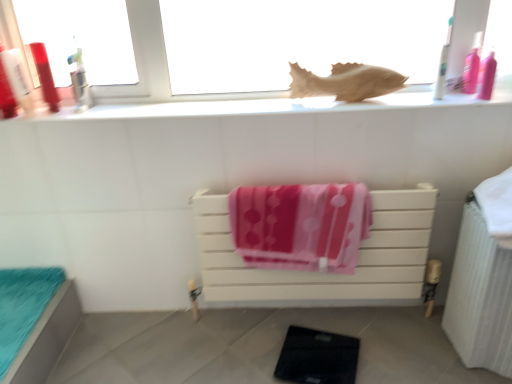
Question: Considering the relative sizes of white textured radiator at right and matte plastic toothbrush at upper left, arranged as the third toiletry when viewed from the right, in the image provided, is white textured radiator at right bigger than matte plastic toothbrush at upper left, arranged as the third toiletry when viewed from the right,?

Choices:
 (A) yes
 (B) no

Answer: (A)

Question: From a real-world perspective, does white textured radiator at right stand above matte plastic toothbrush at upper left, which ranks as the 2th toiletry in left-to-right order?

Choices:
 (A) yes
 (B) no

Answer: (B)

Question: Is white textured radiator at right far from matte plastic toothbrush at upper left, which ranks as the 2th toiletry in left-to-right order?

Choices:
 (A) no
 (B) yes

Answer: (B)

Question: Considering the relative sizes of white textured radiator at right and matte plastic toothbrush at upper left, which ranks as the 2th toiletry in left-to-right order, in the image provided, is white textured radiator at right wider than matte plastic toothbrush at upper left, which ranks as the 2th toiletry in left-to-right order,?

Choices:
 (A) no
 (B) yes

Answer: (B)

Question: Is white textured radiator at right positioned beyond the bounds of matte plastic toothbrush at upper left, arranged as the third toiletry when viewed from the right?

Choices:
 (A) yes
 (B) no

Answer: (A)

Question: Does point (22, 86) appear closer or farther from the camera than point (476, 41)?

Choices:
 (A) closer
 (B) farther

Answer: (A)

Question: From a real-world perspective, is matte plastic bottle at left, which is the 4th toiletry in right-to-left order, positioned above or below pink plastic bottle at upper right, the first toiletry from the right?

Choices:
 (A) above
 (B) below

Answer: (A)

Question: In the image, is matte plastic bottle at left, the 1th toiletry viewed from the left, positioned in front of or behind pink plastic bottle at upper right, positioned as the fourth toiletry in left-to-right order?

Choices:
 (A) behind
 (B) front

Answer: (B)

Question: Choose the correct answer: Is matte plastic bottle at left, which is the 4th toiletry in right-to-left order, inside pink plastic bottle at upper right, positioned as the fourth toiletry in left-to-right order, or outside it?

Choices:
 (A) outside
 (B) inside

Answer: (A)

Question: Would you say pink fabric beach towel at center is to the left or to the right of matte plastic bottle at left, the 1th toiletry viewed from the left, in the picture?

Choices:
 (A) right
 (B) left

Answer: (A)

Question: Is pink fabric beach towel at center inside the boundaries of matte plastic bottle at left, the 1th toiletry viewed from the left, or outside?

Choices:
 (A) inside
 (B) outside

Answer: (B)

Question: From the image's perspective, relative to matte plastic bottle at left, the 1th toiletry viewed from the left, is pink fabric beach towel at center above or below?

Choices:
 (A) above
 (B) below

Answer: (B)

Question: Considering the positions of pink fabric beach towel at center and matte plastic bottle at left, which is the 4th toiletry in right-to-left order, in the image, is pink fabric beach towel at center taller or shorter than matte plastic bottle at left, which is the 4th toiletry in right-to-left order,?

Choices:
 (A) short
 (B) tall

Answer: (B)

Question: Considering the positions of wooden fish at upper center and teal fabric cushion at lower left, placed as the 1th furniture when sorted from left to right, in the image, is wooden fish at upper center wider or thinner than teal fabric cushion at lower left, placed as the 1th furniture when sorted from left to right,?

Choices:
 (A) wide
 (B) thin

Answer: (A)

Question: From the image's perspective, is wooden fish at upper center located above or below teal fabric cushion at lower left, which is the 2th furniture from right to left?

Choices:
 (A) above
 (B) below

Answer: (A)